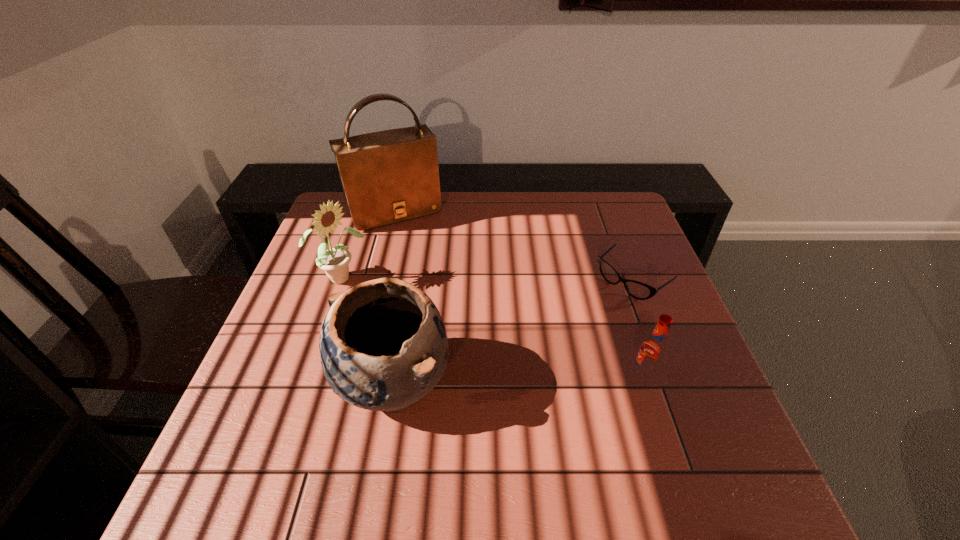
In order to click on pottery in this screenshot , I will do [383, 346].

Locate an element on the screen. This screenshot has width=960, height=540. root beer is located at coordinates (653, 351).

Where is `shoulder bag`? The height and width of the screenshot is (540, 960). shoulder bag is located at coordinates point(390,176).

At what (x,y) coordinates should I click in order to perform the action: click on the farthest object. Please return your answer as a coordinate pair (x, y). The height and width of the screenshot is (540, 960). Looking at the image, I should click on (390, 176).

Locate an element on the screen. The width and height of the screenshot is (960, 540). sunflower is located at coordinates (334, 261).

This screenshot has width=960, height=540. I want to click on the shortest object, so click(x=638, y=290).

This screenshot has width=960, height=540. I want to click on free space located on the right of the pottery, so click(x=479, y=383).

Find the location of a particular element. The image size is (960, 540). vacant space located 0.120m on the back of the root beer is located at coordinates (627, 326).

I want to click on vacant area situated 0.260m on the front flap of the shoulder bag, so click(x=439, y=285).

This screenshot has width=960, height=540. Find the location of `vacant point located 0.270m on the front flap of the shoulder bag`. vacant point located 0.270m on the front flap of the shoulder bag is located at coordinates (440, 287).